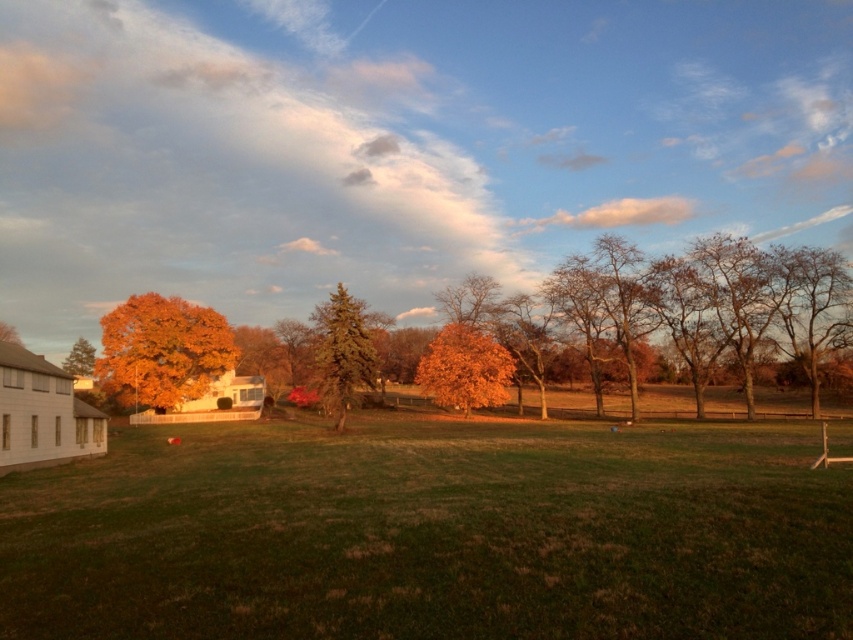
You are standing in the field and want to walk from the orange leafy tree at center to the orange matte tree at left. Which direction should you face to walk directly towards it?

You should face left because the orange leafy tree at center is positioned on the right side of orange matte tree at left.